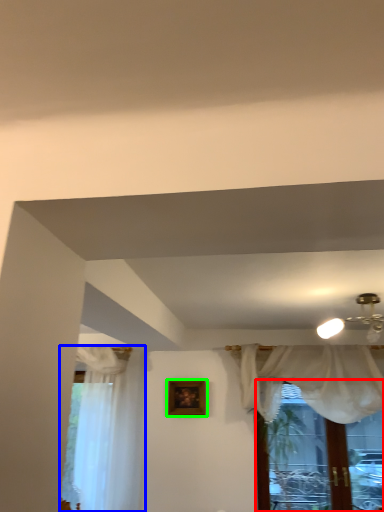
Question: Which object is the closest to the window (highlighted by a red box)? Choose among these: curtain (highlighted by a blue box) or picture frame (highlighted by a green box).

Choices:
 (A) curtain
 (B) picture frame

Answer: (B)